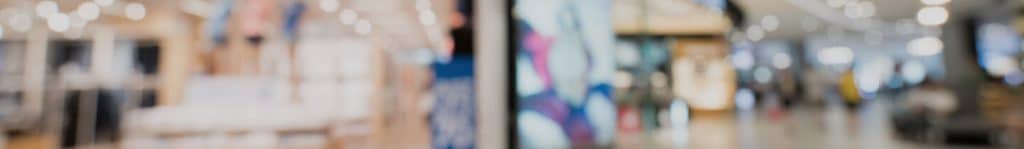
Find the location of a particular element. The width and height of the screenshot is (1024, 149). blurred floor space is located at coordinates (709, 129), (824, 125).